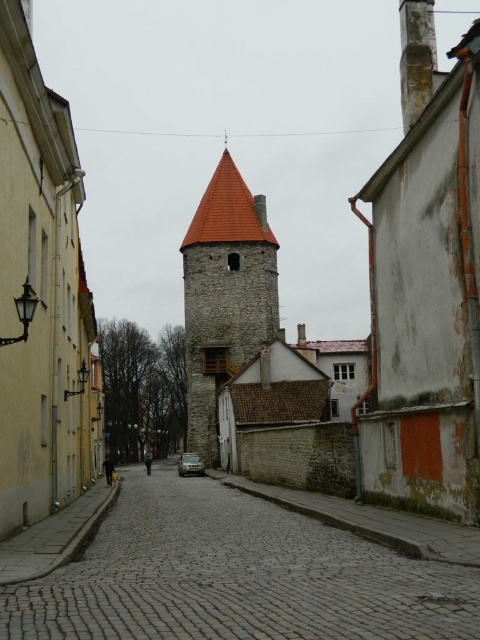
Question: Among these points, which one is nearest to the camera?

Choices:
 (A) (244, 321)
 (B) (453, 602)

Answer: (B)

Question: Can you confirm if cobblestone street at center is positioned above smooth stone bell tower at center?

Choices:
 (A) no
 (B) yes

Answer: (A)

Question: Does cobblestone street at center have a lesser width compared to smooth stone bell tower at center?

Choices:
 (A) no
 (B) yes

Answer: (A)

Question: Can you confirm if cobblestone street at center is positioned above smooth stone bell tower at center?

Choices:
 (A) no
 (B) yes

Answer: (A)

Question: Which object is closer to the camera taking this photo?

Choices:
 (A) smooth stone bell tower at center
 (B) cobblestone street at center

Answer: (B)

Question: Which point is closer to the camera?

Choices:
 (A) (374, 596)
 (B) (201, 371)

Answer: (A)